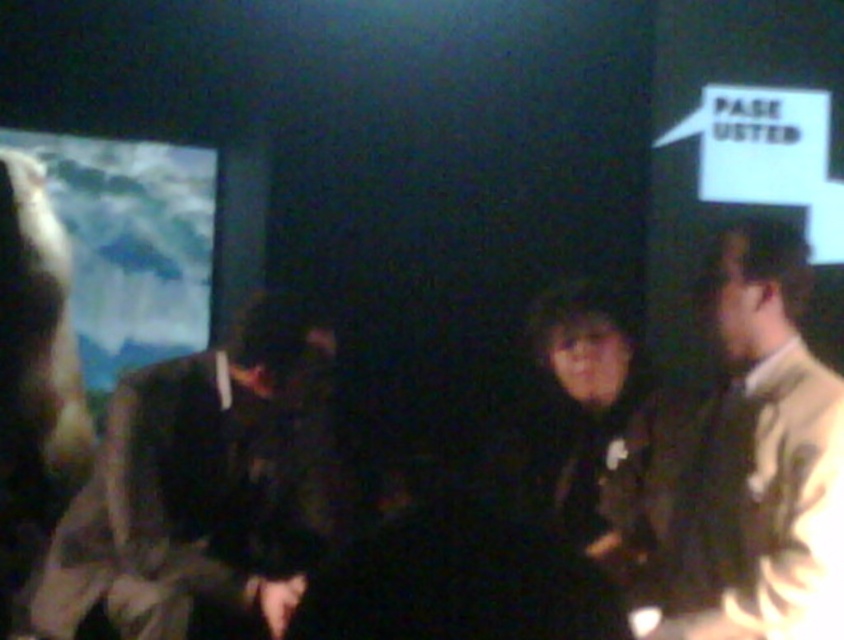
You are organizing a charity event and need to arrange seating based on clothing dimensions. The dark brown suit at left and the light beige jacket at right are both present. Which clothing item requires a wider seat to accommodate its width?

The dark brown suit at left requires a wider seat because its width is larger than the light beige jacket at right.